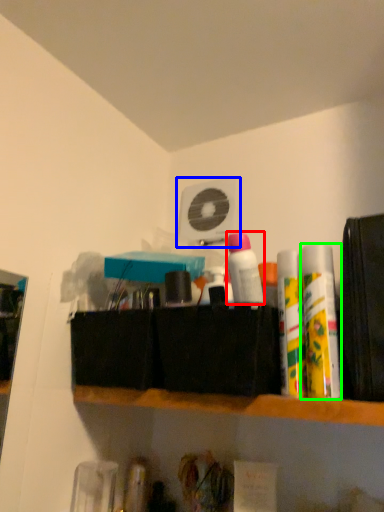
Question: Considering the real-world distances, which object is closest to toiletry (highlighted by a red box)? fan (highlighted by a blue box) or toiletry (highlighted by a green box).

Choices:
 (A) fan
 (B) toiletry

Answer: (B)